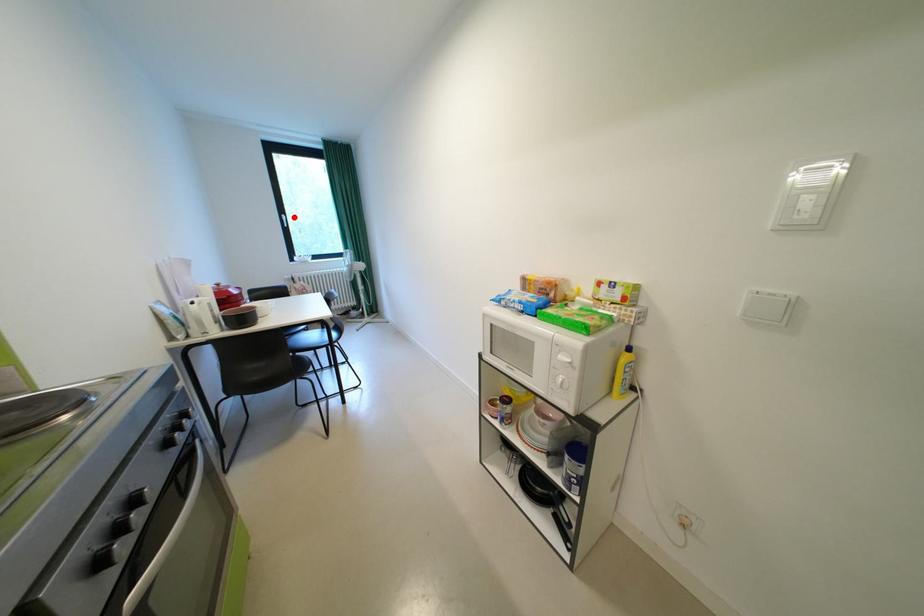
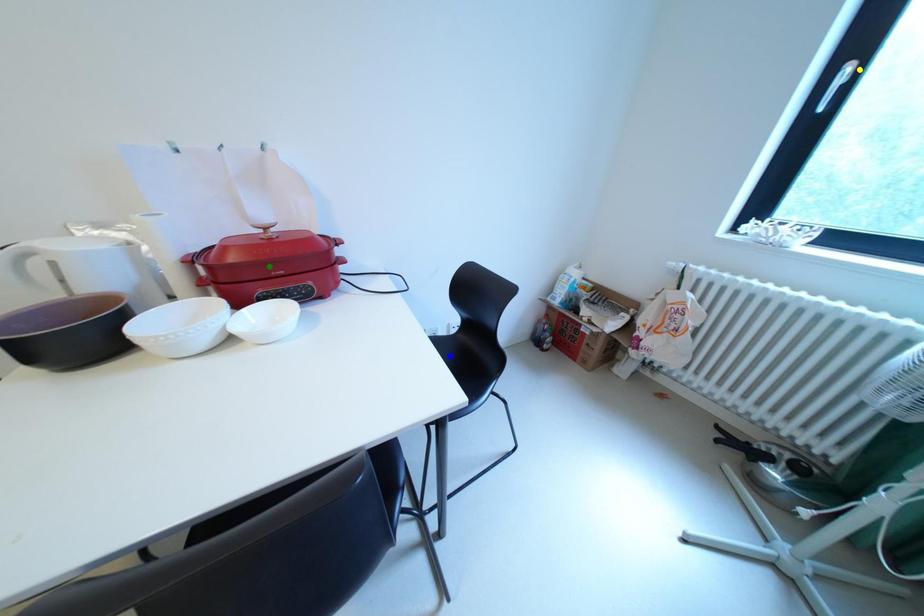
Question: I am providing you with two images of the same scene from different viewpoints. A red point is marked on the first image. You are given multiple points on the second image. Which point in image 2 represents the same 3d spot as the red point in image 1?

Choices:
 (A) yellow point
 (B) green point
 (C) blue point

Answer: (A)